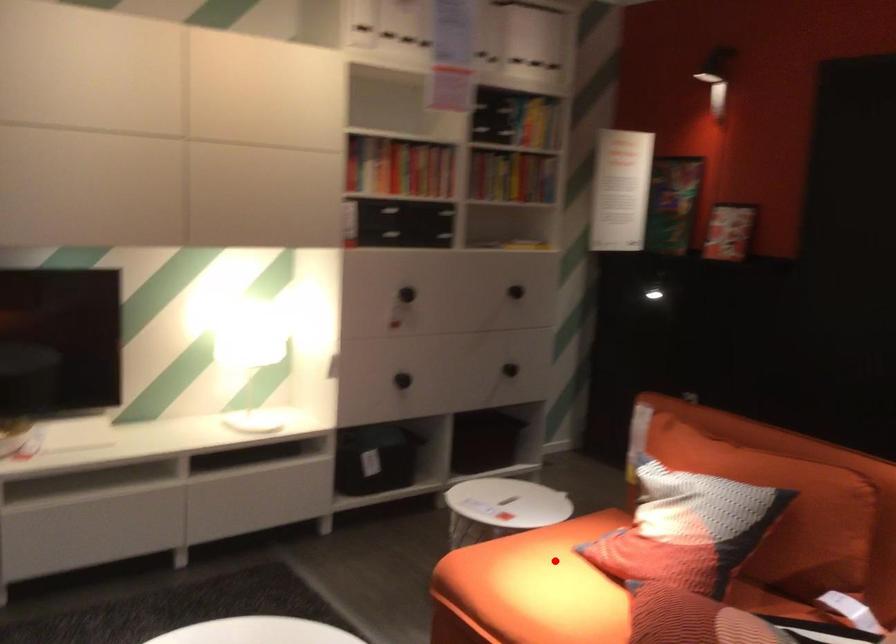
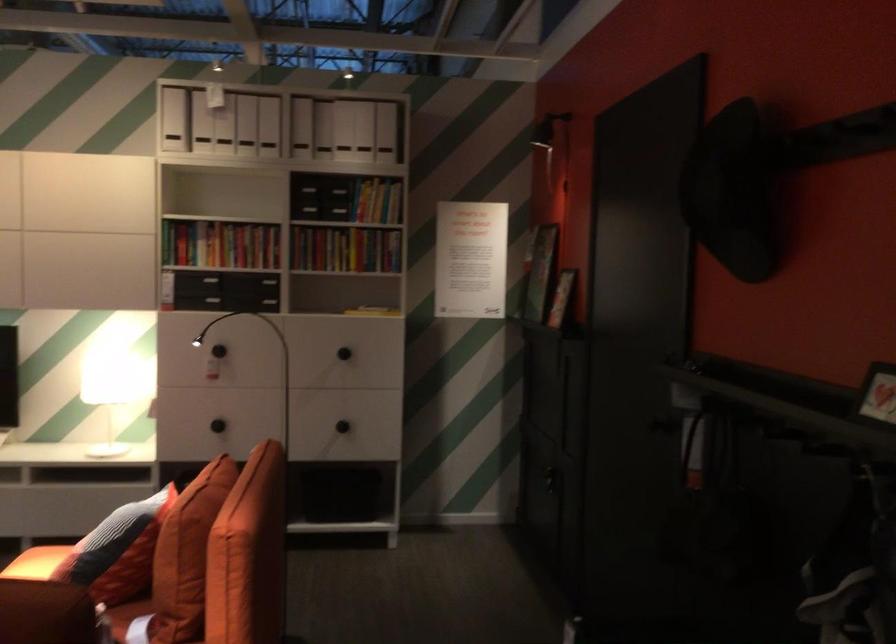
Find the pixel in the second image that matches the highlighted location in the first image.

(36, 563)